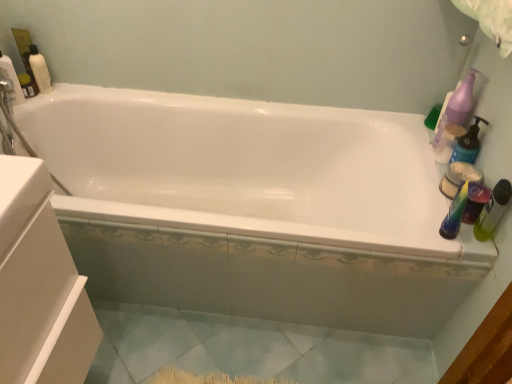
Question: Is point (101, 253) closer or farther from the camera than point (36, 59)?

Choices:
 (A) closer
 (B) farther

Answer: (A)

Question: In the image, is white glossy bathtub at center on the left side or the right side of matte white bottle at upper left, arranged as the 3th cleaning product when viewed from the right?

Choices:
 (A) left
 (B) right

Answer: (B)

Question: Which of these objects is positioned closest to the white glossy bathtub at center?

Choices:
 (A) translucent green bottle at right, acting as the second toiletry starting from the back
 (B) purple plastic pump bottle at upper right, placed as the 2th cleaning product when sorted from bottom to top
 (C) matte plastic container at right, which is the 1th toiletry from back to front
 (D) matte white bottle at upper left, arranged as the 3th cleaning product when viewed from the right
 (E) light blue ceramic tile at lower center

Answer: (E)

Question: Estimate the real-world distances between objects in this image. Which object is farther from the matte purple pump bottle at right, the first cleaning product ordered from the bottom?

Choices:
 (A) matte white bottle at upper left, the 1th cleaning product viewed from the top
 (B) purple plastic pump bottle at upper right, acting as the second cleaning product starting from the top
 (C) light blue ceramic tile at lower center
 (D) matte plastic container at right, which is the 2th toiletry from front to back
 (E) translucent green bottle at right, acting as the second toiletry starting from the back

Answer: (A)